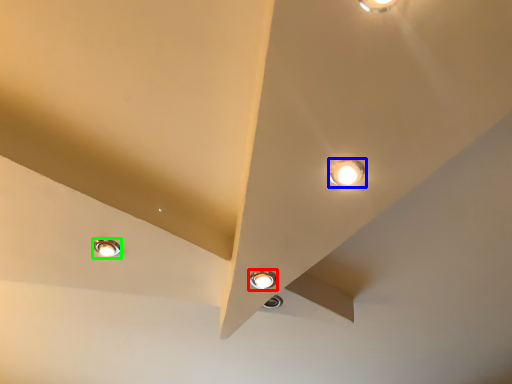
Question: Based on their relative distances, which object is nearer to lamp (highlighted by a red box)? Choose from lamp (highlighted by a blue box) and lamp (highlighted by a green box).

Choices:
 (A) lamp
 (B) lamp

Answer: (A)